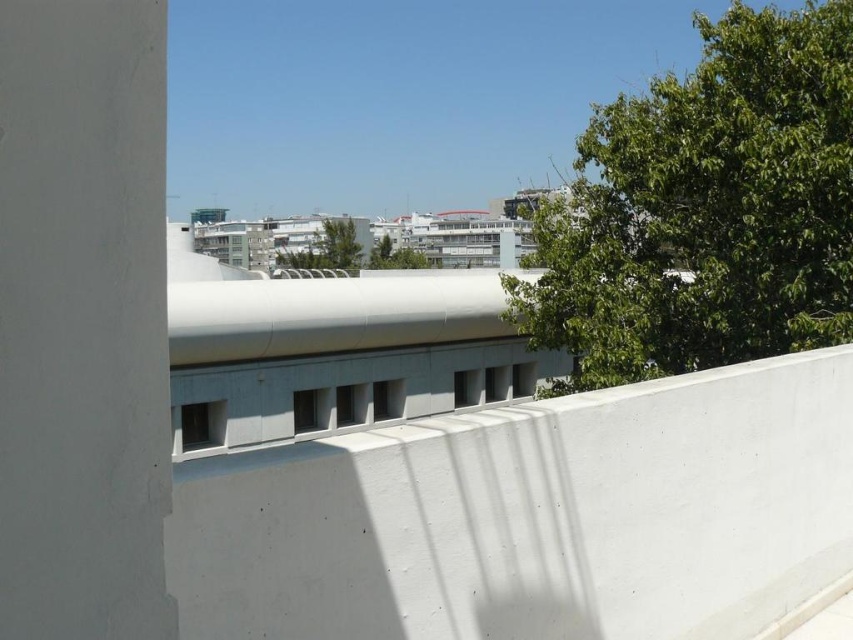
You are standing on the rooftop and want to take a photo of both the green leafy tree at upper right and the green leafy tree at center. Which tree should you position closer to the right edge of your camera frame to include both in the shot?

The green leafy tree at upper right is positioned on the right side of green leafy tree at center, so to include both in the shot, you should position the green leafy tree at upper right closer to the right edge of your camera frame.

You are standing on the rooftop and want to take a photo that includes both the green leafy tree at upper right and the green leafy tree at center. Which tree should you adjust your camera angle to focus on first to ensure both are in the frame?

The green leafy tree at upper right is located above the green leafy tree at center, so you should focus on the green leafy tree at upper right first to ensure both are in the frame.

You are standing on the rooftop and want to take a photo of the green leafy tree at upper right. According to the scene description, where should you position the camera to capture the tree in the upper right corner of the photo?

Position the camera so that the green leafy tree at upper right is centered at the coordinates 0.328 on the x axis and 0.829 on the y axis, which corresponds to the upper right corner of the photo.